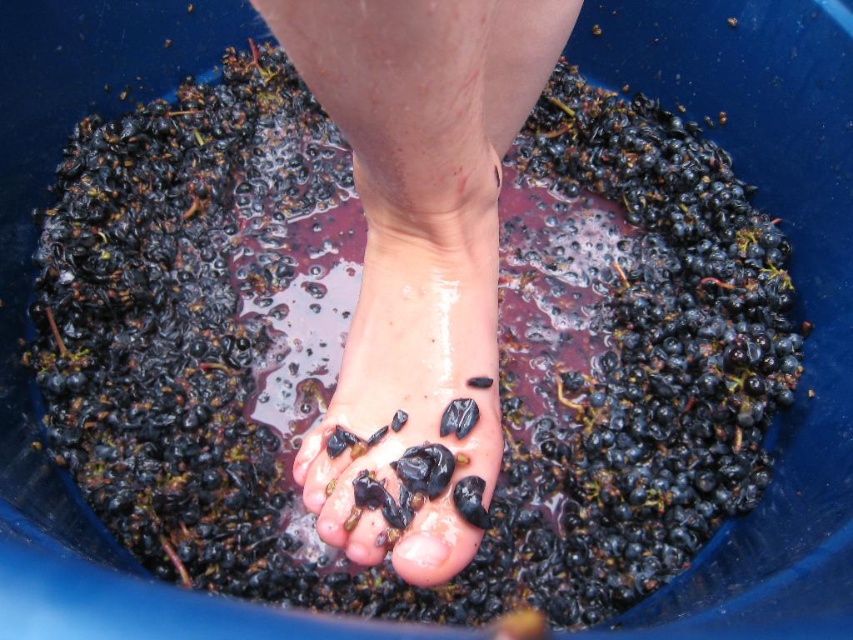
Does wet dark grapes at center appear over glossy black toe at center?

Yes, wet dark grapes at center is above glossy black toe at center.

Does point (389, 273) come closer to viewer compared to point (402, 552)?

No, it is behind (402, 552).

Identify the location of wet dark grapes at center. The image size is (853, 640). (408, 365).

Is wet skin foot at center above glossy black toe at center?

Yes.

Does wet skin foot at center have a lesser height compared to glossy black toe at center?

No.

The width and height of the screenshot is (853, 640). In order to click on wet skin foot at center in this screenshot , I will do `click(418, 230)`.

Measure the distance between wet skin foot at center and wet dark grapes at center.

wet skin foot at center and wet dark grapes at center are 2.00 inches apart.

Is wet skin foot at center to the right of wet dark grapes at center from the viewer's perspective?

Correct, you'll find wet skin foot at center to the right of wet dark grapes at center.

Image resolution: width=853 pixels, height=640 pixels. I want to click on wet skin foot at center, so click(x=418, y=230).